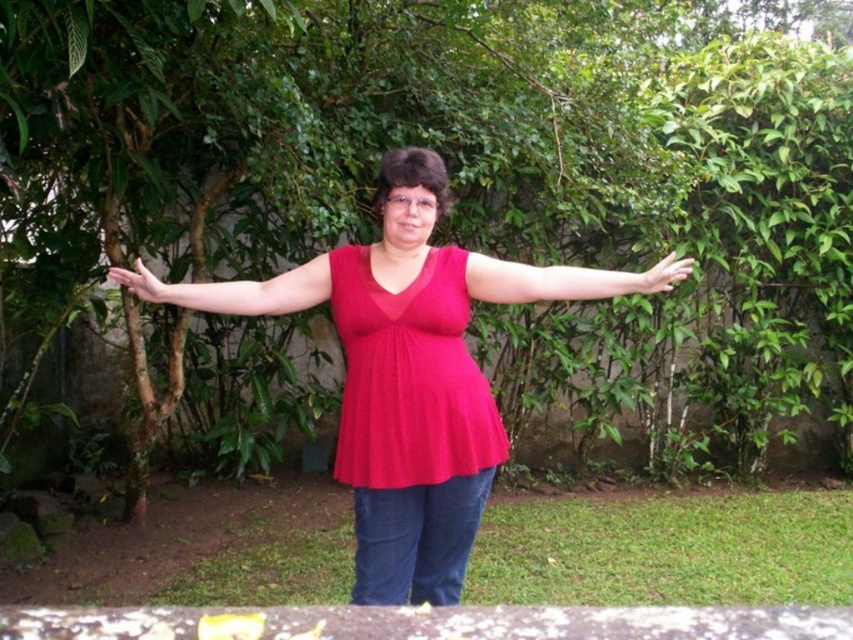
Consider the image. You are a drone operator trying to capture a closeup of the person in the garden. You have two points marked in the image for focus adjustments. The first point is at coordinates point (x=344, y=266) and the second point is at point (x=653, y=280). Which point should you focus on to get a clearer image of the person?

Point (x=344, y=266) is further to the viewer than point (x=653, y=280), so focusing on point (x=344, y=266) will provide a clearer image of the person since it is closer to the camera.

You are a photographer trying to capture the person in the image. The person is standing at the center of the frame. You want to place a focus point at the exact center of the frame to ensure the person is sharp. The camera has a focus point grid with coordinates ranging from 0 to 1 on both axes. The point at coordinates point (x=397, y=387) is available. Is this point suitable for focusing on the matte red blouse at center?

The point at coordinates (x=397, y=387) corresponds to the matte red blouse at center, so yes, this point is suitable for focusing on the matte red blouse at center.

Consider the image. You are taking a photo of the person in the garden. You want to focus on the point at point (148, 273) and point (152, 289). Which point should you focus on first to ensure both points are in focus?

You should focus on point (148, 273) first because it is closer to the camera than point (152, 289). By focusing on the closer point, the farther point will also be within the depth of field.